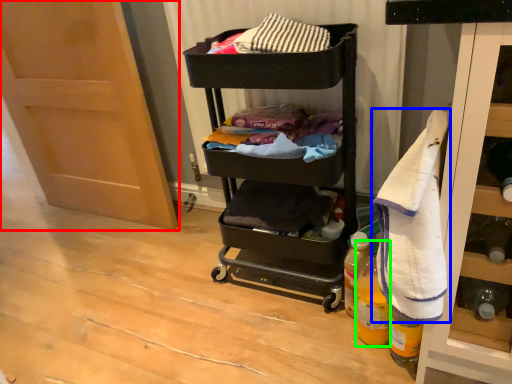
Question: Which object is positioned closest to door (highlighted by a red box)? Select from bath towel (highlighted by a blue box) and bottle (highlighted by a green box).

Choices:
 (A) bath towel
 (B) bottle

Answer: (B)